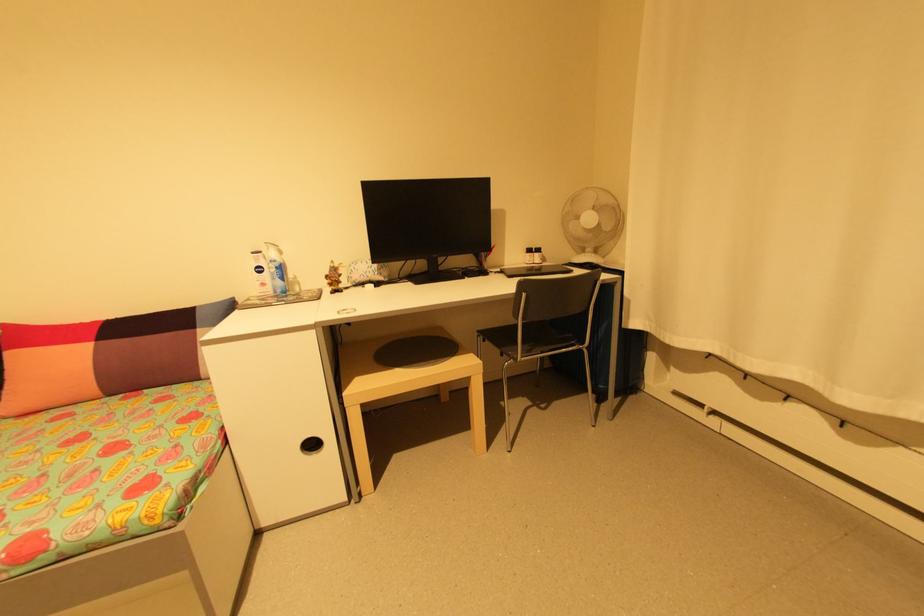
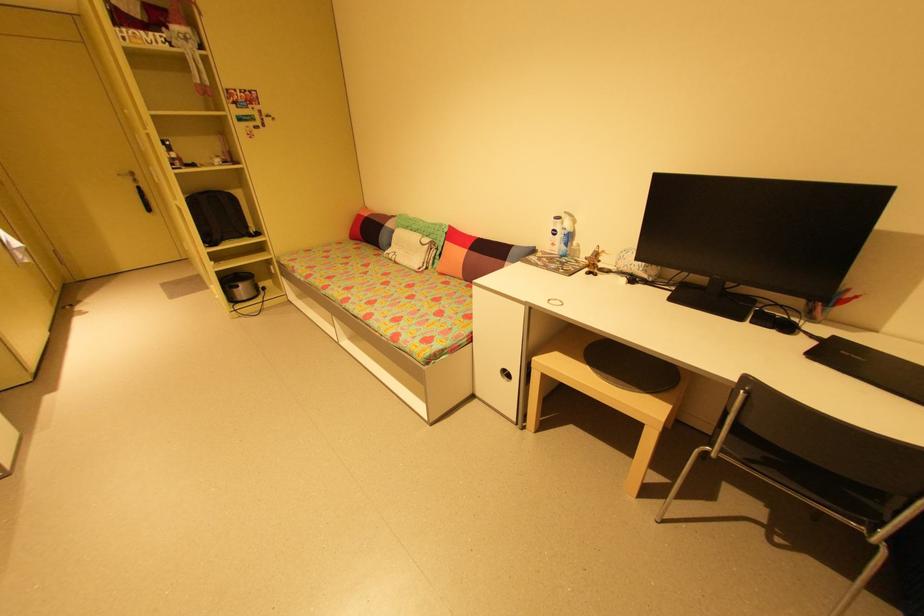
Locate, in the second image, the point that corresponds to (x=578, y=342) in the first image.

(869, 519)